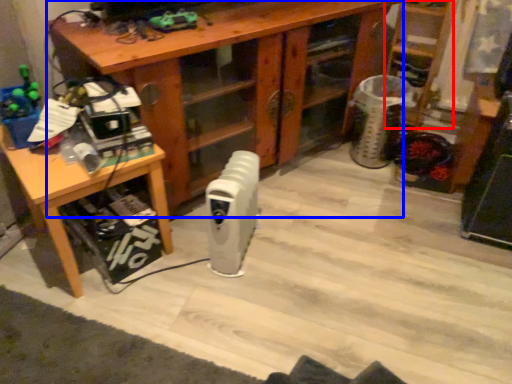
Question: Which object is closer to the camera taking this photo, shelf (highlighted by a red box) or desk (highlighted by a blue box)?

Choices:
 (A) shelf
 (B) desk

Answer: (B)